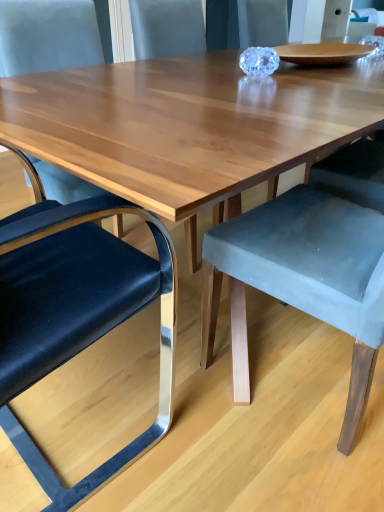
Question: Is velvet grey chair at center, which is counted as the third chair, starting from the left, wider or thinner than metallic blue cushioned chair at left, the 1th chair from the left?

Choices:
 (A) thin
 (B) wide

Answer: (B)

Question: From a real-world perspective, relative to metallic blue cushioned chair at left, which ranks as the third chair in right-to-left order, is velvet grey chair at center, which appears as the 1th chair when viewed from the right, vertically above or below?

Choices:
 (A) above
 (B) below

Answer: (A)

Question: Based on their relative distances, which object is nearer to the velvet grey chair at center, which appears as the 1th chair when viewed from the right?

Choices:
 (A) metallic blue cushioned chair at left, the 1th chair from the left
 (B) velvet blue chair at left, acting as the 2th chair starting from the right

Answer: (A)

Question: Which object is the closest to the velvet blue chair at left, which is counted as the second chair, starting from the left?

Choices:
 (A) metallic blue cushioned chair at left, which ranks as the third chair in right-to-left order
 (B) velvet grey chair at center, which appears as the 1th chair when viewed from the right

Answer: (A)